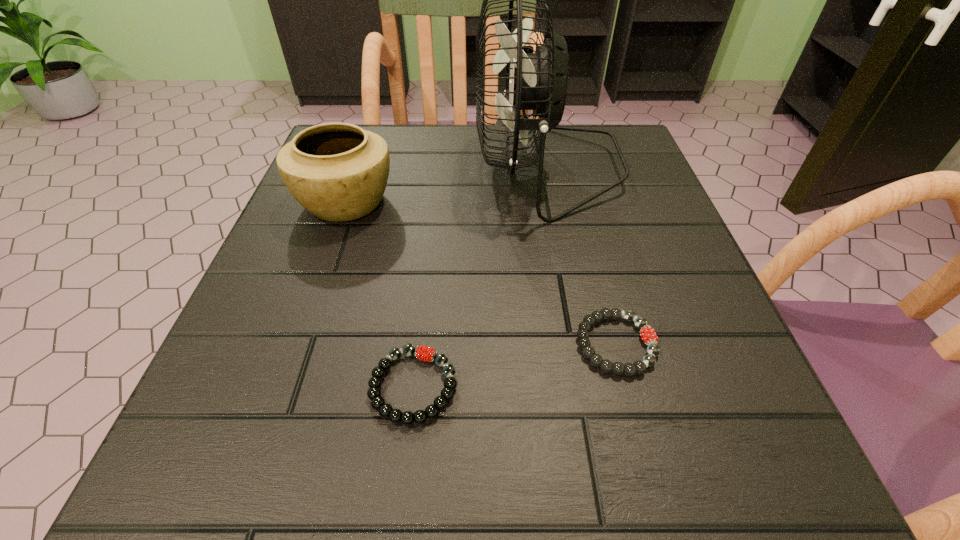
The width and height of the screenshot is (960, 540). In order to click on free space that is in between the second object from left to right and the right bracelet in this screenshot , I will do `click(515, 365)`.

This screenshot has width=960, height=540. In order to click on free space that is in between the left bracelet and the leftmost object in this screenshot , I will do `click(380, 294)`.

The image size is (960, 540). I want to click on free space that is in between the fan and the left bracelet, so click(x=481, y=277).

Identify the location of vacant region between the second tallest object and the fan. The width and height of the screenshot is (960, 540). (446, 185).

The width and height of the screenshot is (960, 540). Find the location of `free space between the tallest object and the leftmost object`. free space between the tallest object and the leftmost object is located at coordinates (446, 185).

The width and height of the screenshot is (960, 540). Find the location of `object that is the second closest one to the second object from left to right`. object that is the second closest one to the second object from left to right is located at coordinates (338, 172).

Identify the location of object that ranks as the third closest to the right bracelet. This screenshot has height=540, width=960. 338,172.

At what (x,y) coordinates should I click in order to perform the action: click on vacant space that satisfies the following two spatial constraints: 1. in front of the fan, directing airflow; 2. on the back side of the right bracelet. Please return your answer as a coordinate pair (x, y). The image size is (960, 540). Looking at the image, I should click on (582, 345).

Identify the location of vacant region that satisfies the following two spatial constraints: 1. in front of the tallest object, directing airflow; 2. on the front side of the left bracelet. Image resolution: width=960 pixels, height=540 pixels. (589, 386).